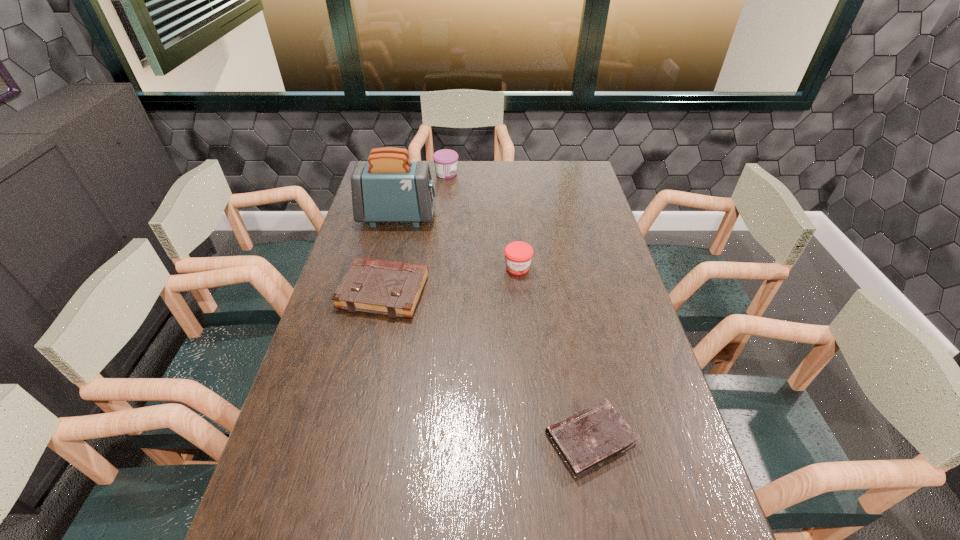
Where is `vacant space that satisfies the following two spatial constraints: 1. on the front-facing side of the second shortest object; 2. on the right side of the tallest object`? The image size is (960, 540). vacant space that satisfies the following two spatial constraints: 1. on the front-facing side of the second shortest object; 2. on the right side of the tallest object is located at coordinates (380, 292).

Find the location of a particular element. free space that satisfies the following two spatial constraints: 1. on the back side of the diary; 2. on the front label of the farthest object is located at coordinates (540, 173).

Where is `free space that satisfies the following two spatial constraints: 1. on the front-facing side of the hardback book; 2. on the right side of the toaster`? The width and height of the screenshot is (960, 540). free space that satisfies the following two spatial constraints: 1. on the front-facing side of the hardback book; 2. on the right side of the toaster is located at coordinates (380, 292).

You are a GUI agent. You are given a task and a screenshot of the screen. Output one action in this format:
    pyautogui.click(x=<x>, y=<y>)
    Task: Click on the free space that satisfies the following two spatial constraints: 1. on the front-facing side of the tallest object; 2. on the right side of the nearest object
    Image resolution: width=960 pixels, height=540 pixels.
    Given the screenshot: What is the action you would take?
    pyautogui.click(x=346, y=439)

Find the location of `vacant area that satisfies the following two spatial constraints: 1. on the front-facing side of the fourth tallest object; 2. on the right side of the toaster`. vacant area that satisfies the following two spatial constraints: 1. on the front-facing side of the fourth tallest object; 2. on the right side of the toaster is located at coordinates (380, 292).

The width and height of the screenshot is (960, 540). I want to click on vacant space that satisfies the following two spatial constraints: 1. on the front-facing side of the fourth nearest object; 2. on the left side of the second shortest object, so click(380, 292).

Where is `blank area in the image that satisfies the following two spatial constraints: 1. on the front label of the farther jam; 2. on the front side of the hardback book`? blank area in the image that satisfies the following two spatial constraints: 1. on the front label of the farther jam; 2. on the front side of the hardback book is located at coordinates (434, 292).

Where is `blank space that satisfies the following two spatial constraints: 1. on the front-facing side of the diary; 2. on the left side of the tallest object`? The width and height of the screenshot is (960, 540). blank space that satisfies the following two spatial constraints: 1. on the front-facing side of the diary; 2. on the left side of the tallest object is located at coordinates (x=346, y=439).